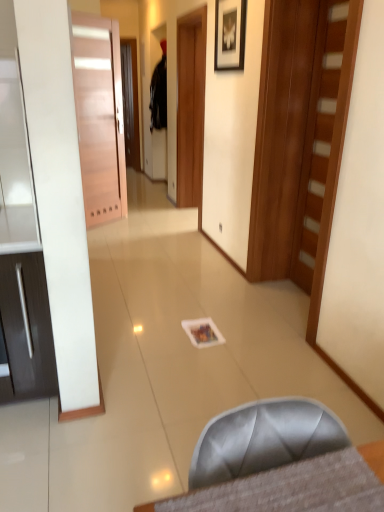
Question: Do you think matte pink door at left, which is the first door in back-to-front order, is within black fabric robe at upper center, or outside of it?

Choices:
 (A) inside
 (B) outside

Answer: (B)

Question: From the image's perspective, is matte pink door at left, placed as the 2th door when sorted from right to left, positioned above or below black fabric robe at upper center?

Choices:
 (A) above
 (B) below

Answer: (B)

Question: Estimate the real-world distances between objects in this image. Which object is closer to the wooden door at right, positioned as the first door in right-to-left order?

Choices:
 (A) matte pink door at left, which appears as the second door when viewed from the front
 (B) black fabric robe at upper center
 (C) satin gray chair at lower center
 (D) matte black picture frame at upper center

Answer: (D)

Question: Which object is positioned closest to the black fabric robe at upper center?

Choices:
 (A) matte black picture frame at upper center
 (B) satin gray chair at lower center
 (C) wooden door at right, which appears as the second door when viewed from the back
 (D) matte pink door at left, placed as the 2th door when sorted from right to left

Answer: (D)